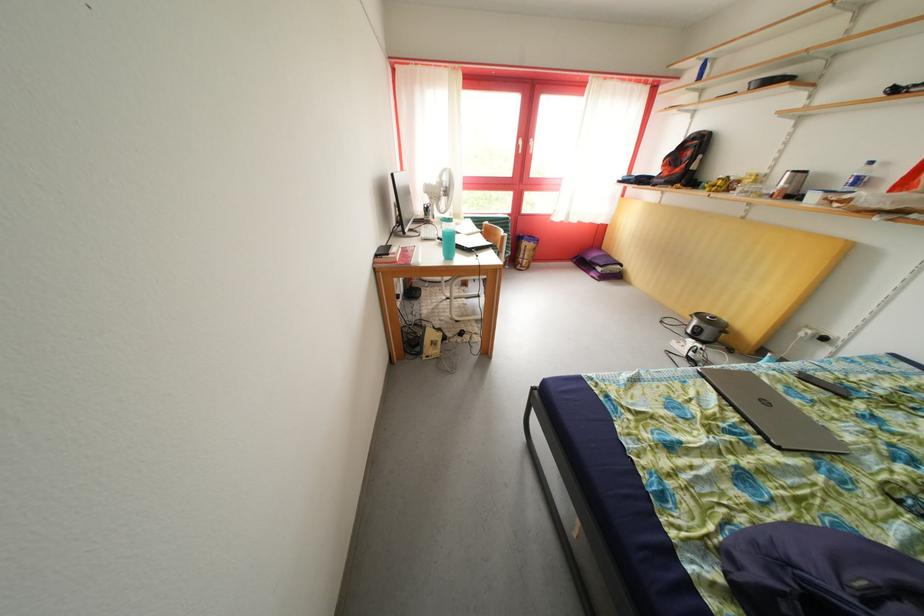
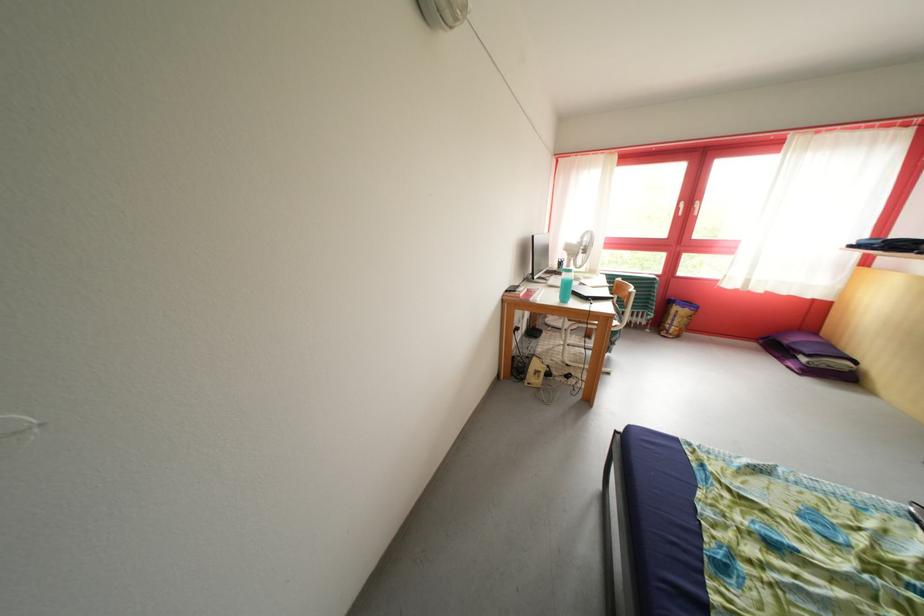
Question: How did the camera likely rotate?

Choices:
 (A) Left
 (B) Right
 (C) Up
 (D) Down

Answer: (A)